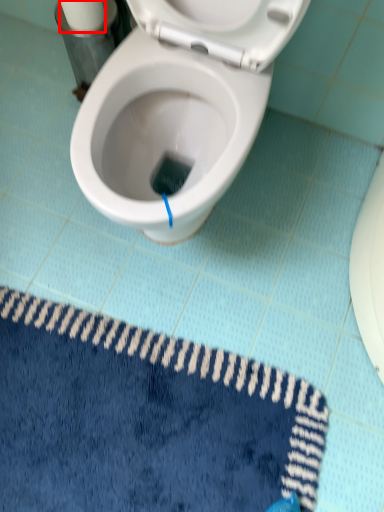
Question: From the image's perspective, what is the correct spatial positioning of toilet paper (annotated by the red box) in reference to bath mat?

Choices:
 (A) above
 (B) below

Answer: (A)